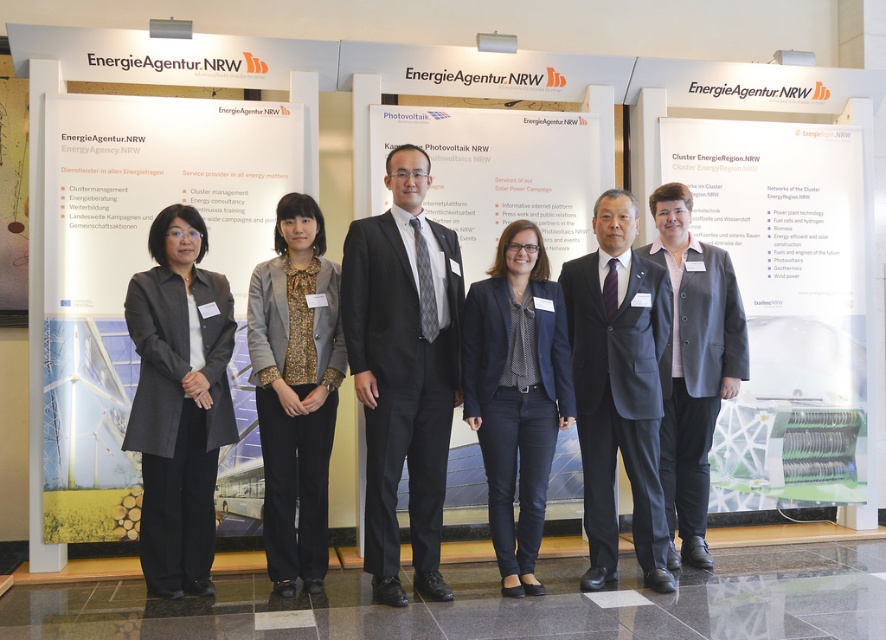
Question: Which of these objects is positioned farthest from the green matte solar panel at center?

Choices:
 (A) dark gray matte blazer at center
 (B) black wool suit at center

Answer: (A)

Question: Does dark blue blazer at center have a smaller size compared to navy blue suit at center?

Choices:
 (A) no
 (B) yes

Answer: (B)

Question: Which of the following is the closest to the observer?

Choices:
 (A) (138, 237)
 (B) (713, 410)
 (C) (797, 204)

Answer: (B)

Question: Can you confirm if dark gray matte blazer at center is thinner than dark gray wool suit at center?

Choices:
 (A) no
 (B) yes

Answer: (B)

Question: Does matte white poster at left come behind dark gray wool suit at center?

Choices:
 (A) no
 (B) yes

Answer: (A)

Question: Estimate the real-world distances between objects in this image. Which object is farther from the matte white poster at left?

Choices:
 (A) dark gray wool suit at center
 (B) green matte solar panel at center
 (C) gray textured blazer at center
 (D) black wool suit at center

Answer: (B)